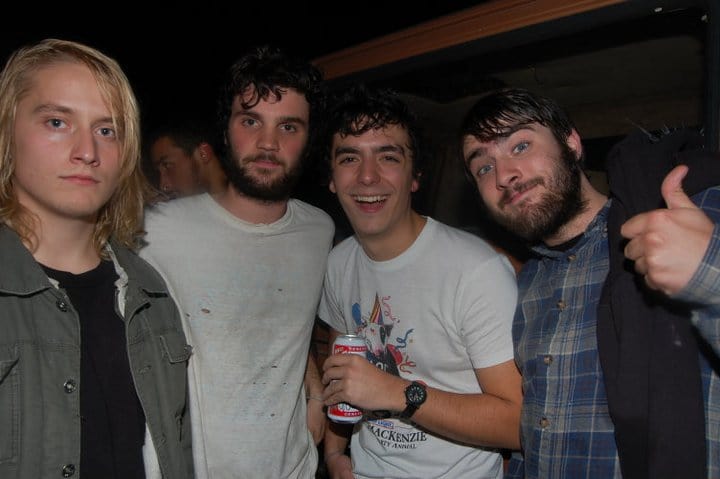
This screenshot has height=479, width=720. What are the coordinates of `wood beam` in the screenshot? It's located at (435, 46).